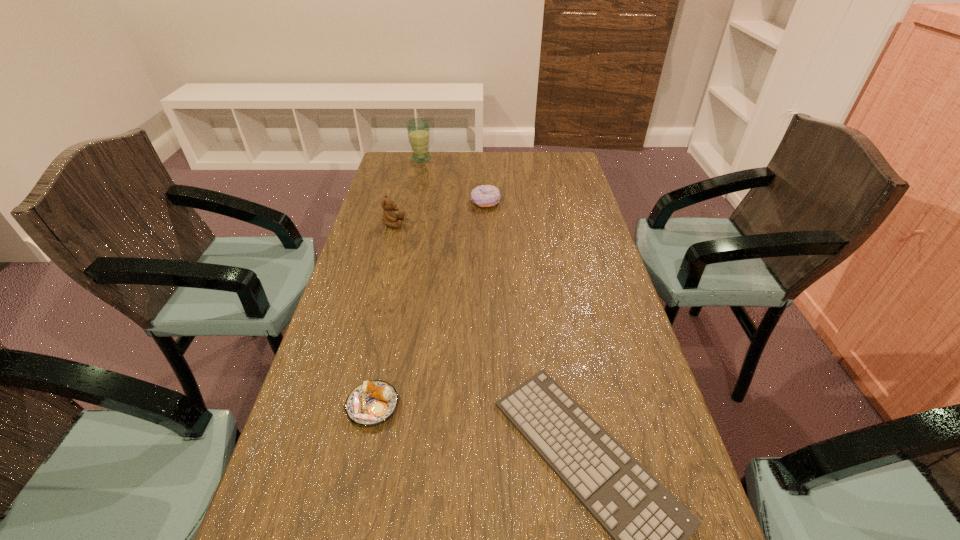
Where is `the farthest object`? The height and width of the screenshot is (540, 960). the farthest object is located at coordinates (418, 129).

Identify the location of glass. (418, 129).

Where is `the third nearest object`? The height and width of the screenshot is (540, 960). the third nearest object is located at coordinates (389, 217).

Locate an element on the screen. This screenshot has width=960, height=540. the second tallest object is located at coordinates point(389,217).

Where is `the fourth nearest object`? the fourth nearest object is located at coordinates click(485, 195).

What are the coordinates of `the third tallest object` in the screenshot? It's located at (485, 195).

You are a GUI agent. You are given a task and a screenshot of the screen. Output one action in this format:
    pyautogui.click(x=<x>, y=<y>)
    Task: Click on the fourth tallest object
    The height and width of the screenshot is (540, 960).
    Given the screenshot: What is the action you would take?
    pyautogui.click(x=372, y=402)

I want to click on vacant space located on the front of the farthest object, so click(411, 208).

You are a GUI agent. You are given a task and a screenshot of the screen. Output one action in this format:
    pyautogui.click(x=<x>, y=<y>)
    Task: Click on the vacant area located on the front-facing side of the teddy bear
    
    Given the screenshot: What is the action you would take?
    pyautogui.click(x=422, y=224)

Image resolution: width=960 pixels, height=540 pixels. I want to click on free space located 0.150m on the back of the second farthest object, so click(x=485, y=174).